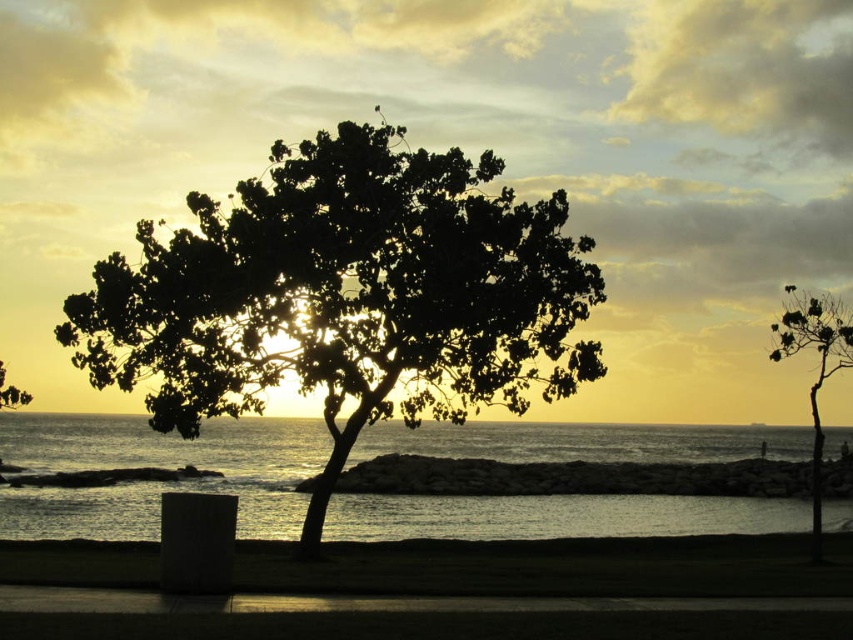
Which is in front, point (476, 369) or point (840, 364)?

Point (840, 364) is in front.

Who is higher up, silhouette leafy tree at center or silhouette leafy tree at right?

silhouette leafy tree at center is higher up.

Between point (311, 536) and point (816, 516), which one is positioned behind?

Point (816, 516)

Find the location of a particular element. silhouette leafy tree at center is located at coordinates (346, 296).

Between silhouette leafy tree at center and silvery water at center, which one appears on the right side from the viewer's perspective?

silhouette leafy tree at center is more to the right.

Locate an element on the screen. The image size is (853, 640). silhouette leafy tree at center is located at coordinates (346, 296).

Does silvery water at center have a lesser width compared to silhouette leafy tree at right?

No.

What do you see at coordinates (158, 467) in the screenshot?
I see `silvery water at center` at bounding box center [158, 467].

Identify the location of silvery water at center. (158, 467).